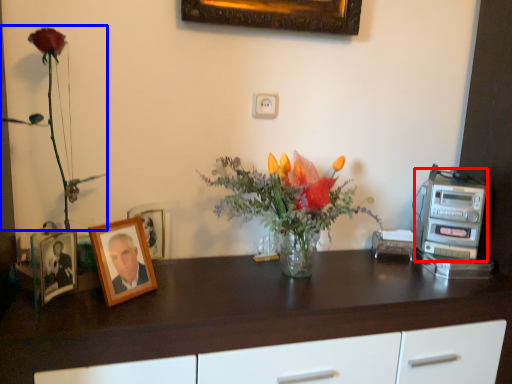
Question: Which point is further to the camera, appliance (highlighted by a red box) or floral arrangement (highlighted by a blue box)?

Choices:
 (A) appliance
 (B) floral arrangement

Answer: (A)